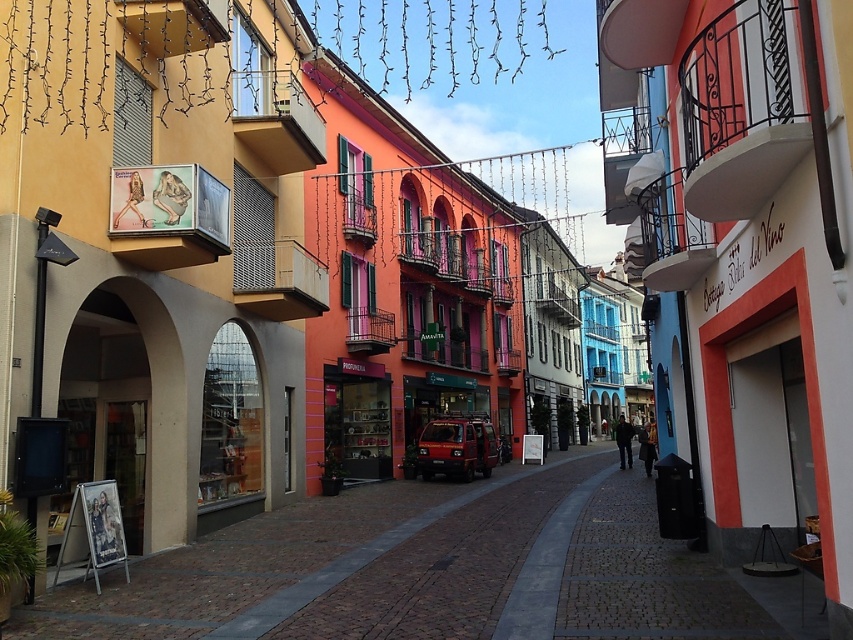
Question: Does brick paved alley at center appear on the left side of matte red van at center?

Choices:
 (A) no
 (B) yes

Answer: (B)

Question: From the image, what is the correct spatial relationship of brick paved alley at center in relation to matte red van at center?

Choices:
 (A) left
 (B) right

Answer: (A)

Question: Which of the following is the farthest from the observer?

Choices:
 (A) matte red van at center
 (B) brick paved alley at center

Answer: (A)

Question: Does brick paved alley at center appear on the left side of matte red van at center?

Choices:
 (A) no
 (B) yes

Answer: (B)

Question: Among these points, which one is farthest from the camera?

Choices:
 (A) (432, 474)
 (B) (318, 552)

Answer: (A)